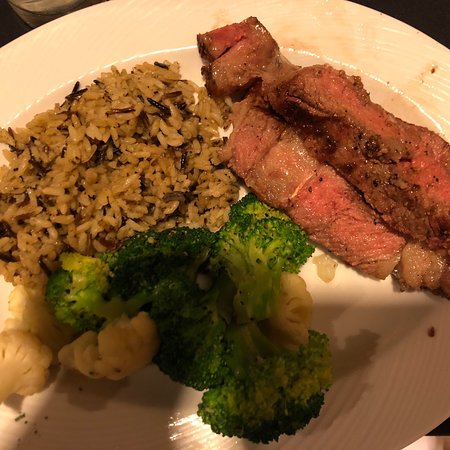
Where is `plate`? This screenshot has height=450, width=450. plate is located at coordinates (48, 56).